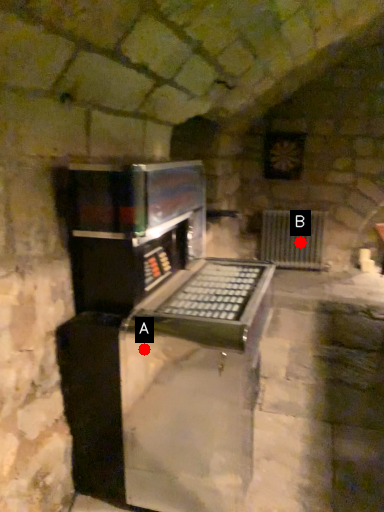
Question: Two points are circled on the image, labeled by A and B beside each circle. Which point is closer to the camera?

Choices:
 (A) A is closer
 (B) B is closer

Answer: (A)